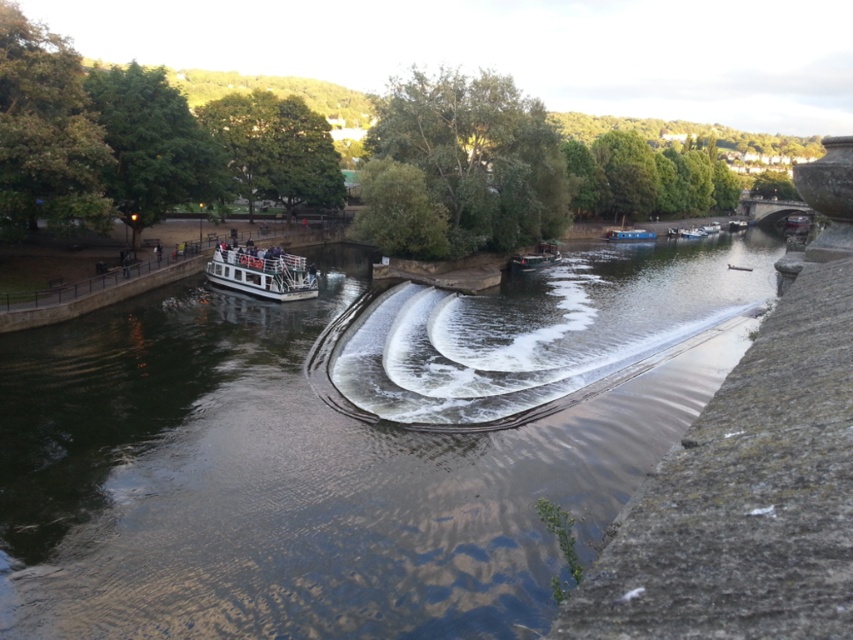
Is white glossy boat at center to the left of wooden boat at center from the viewer's perspective?

Indeed, white glossy boat at center is positioned on the left side of wooden boat at center.

How far apart are white glossy boat at center and wooden boat at center?

The distance of white glossy boat at center from wooden boat at center is 90.29 feet.

Locate an element on the screen. The image size is (853, 640). white glossy boat at center is located at coordinates (260, 273).

Does dark green water at center lie behind wooden boat at center?

No, dark green water at center is closer to the viewer.

Can you confirm if dark green water at center is positioned to the left of wooden boat at center?

Correct, you'll find dark green water at center to the left of wooden boat at center.

Is point (277, 436) farther from camera compared to point (547, 241)?

No, it is in front of (547, 241).

Find the location of `dark green water at center`. dark green water at center is located at coordinates pos(286,481).

Between point (233, 268) and point (648, 234), which one is positioned in front?

Point (233, 268)

Is white glossy boat at center smaller than blue glossy houseboat at center?

Incorrect, white glossy boat at center is not smaller in size than blue glossy houseboat at center.

Find the location of a particular element. The height and width of the screenshot is (640, 853). white glossy boat at center is located at coordinates (260, 273).

Where is `white glossy boat at center`? This screenshot has width=853, height=640. white glossy boat at center is located at coordinates (260, 273).